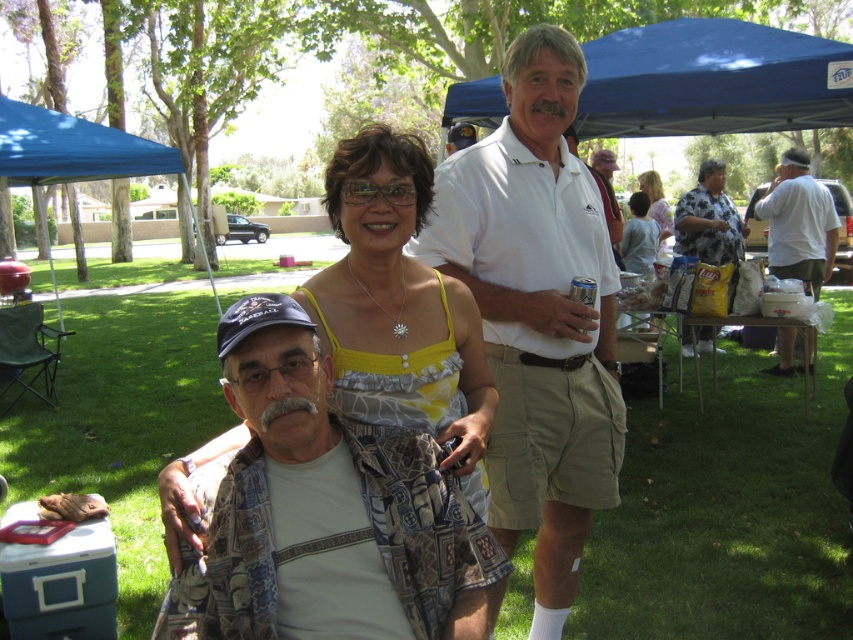
You are at an outdoor gathering and see two people wearing the yellow fabric dress at center and the floral shirt at right. Which one is standing closer to the front?

The yellow fabric dress at center is positioned under the floral shirt at right, so the floral shirt at right is standing closer to the front.

Looking at this image, you are at a community event and want to stay under the shade. You see the blue fabric canopy at upper left and the white cotton shirt at center. Which object is providing shade to the other?

The blue fabric canopy at upper left is positioned over the white cotton shirt at center, so it is providing shade to the white cotton shirt at center.

You are a photographer positioned at the back of the scene. You want to take a photo that includes both the white cotton polo shirt at center and the blue fabric canopy at upper left. Which object will appear larger in your photo?

The white cotton polo shirt at center will appear larger in the photo because it is closer to the viewer than the blue fabric canopy at upper left.